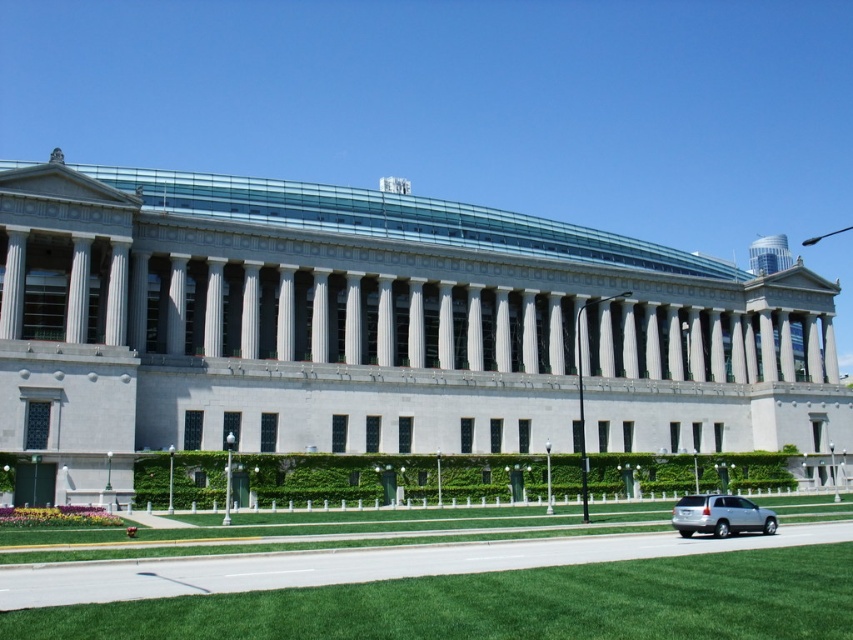
Question: Is green grass at lower center thinner than silver metallic suv at lower right?

Choices:
 (A) no
 (B) yes

Answer: (A)

Question: Can you confirm if green grass at lower center is wider than silver metallic suv at lower right?

Choices:
 (A) no
 (B) yes

Answer: (B)

Question: Which point is closer to the camera?

Choices:
 (A) green grass at lower center
 (B) silver metallic suv at lower right

Answer: (A)

Question: Considering the relative positions of green grass at lower center and silver metallic suv at lower right in the image provided, where is green grass at lower center located with respect to silver metallic suv at lower right?

Choices:
 (A) right
 (B) left

Answer: (B)